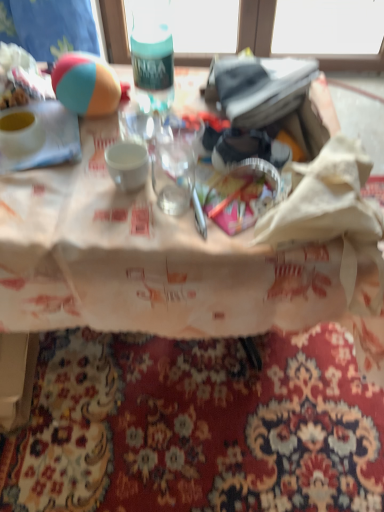
Locate an element on the screen. The height and width of the screenshot is (512, 384). vacant area that lies in front of teal matte bottle at upper center is located at coordinates (144, 137).